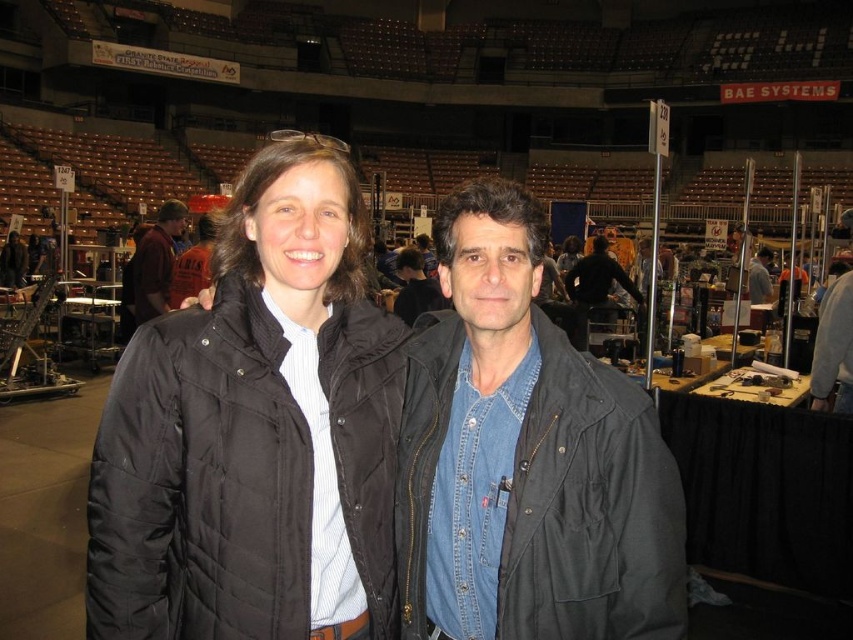
Question: Estimate the real-world distances between objects in this image. Which object is closer to the black quilted jacket at center?

Choices:
 (A) denim shirt at center
 (B) dark brown leather jacket at left

Answer: (A)

Question: Among these objects, which one is nearest to the camera?

Choices:
 (A) black quilted jacket at center
 (B) denim shirt at center
 (C) dark brown leather jacket at left

Answer: (A)

Question: Which object appears farthest from the camera in this image?

Choices:
 (A) denim shirt at center
 (B) black quilted jacket at center

Answer: (A)

Question: Can you confirm if black quilted jacket at center is positioned above denim shirt at center?

Choices:
 (A) no
 (B) yes

Answer: (B)

Question: Is black quilted jacket at center further to the viewer compared to dark brown leather jacket at left?

Choices:
 (A) no
 (B) yes

Answer: (A)

Question: Does black quilted jacket at center appear under dark brown leather jacket at left?

Choices:
 (A) no
 (B) yes

Answer: (B)